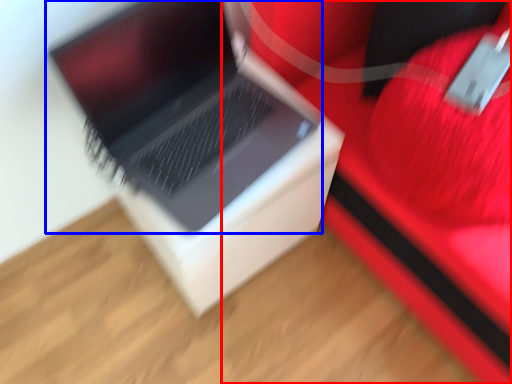
Question: Which of the following is the farthest to the observer, furniture (highlighted by a red box) or laptop (highlighted by a blue box)?

Choices:
 (A) furniture
 (B) laptop

Answer: (B)